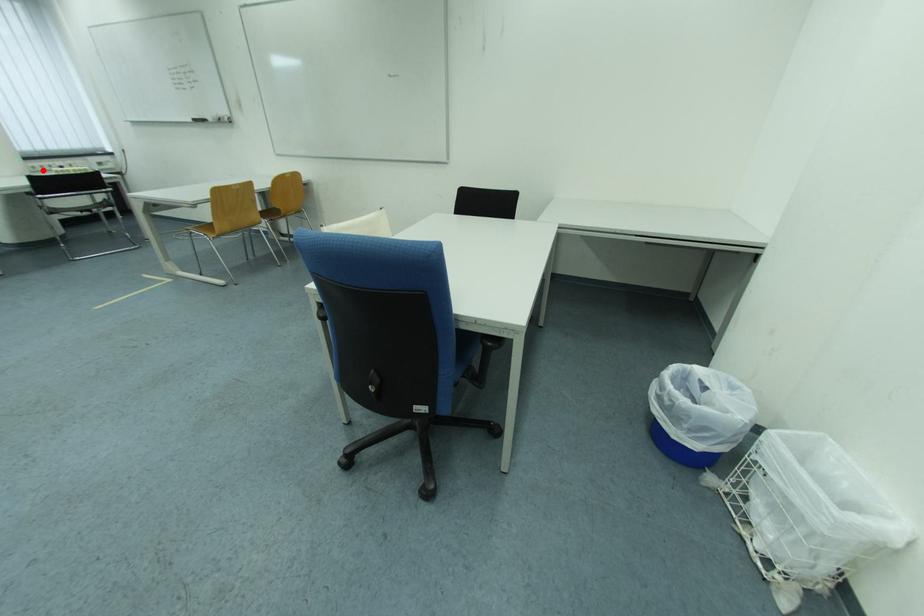
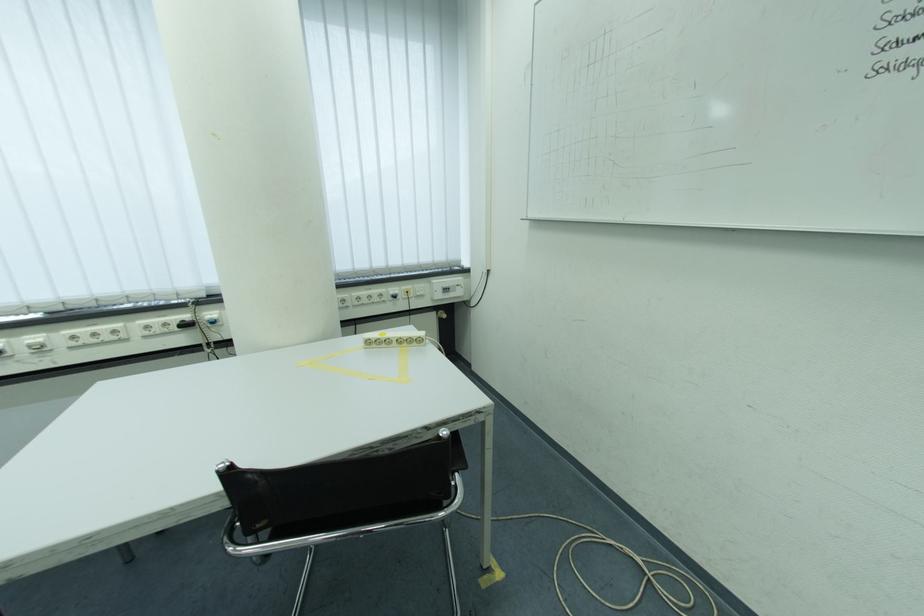
Question: I am providing you with two images of the same scene from different viewpoints. A red point is shown in image1. For the corresponding object point in image2, is it positioned nearer or farther from the camera?

Choices:
 (A) Nearer
 (B) Farther

Answer: (A)